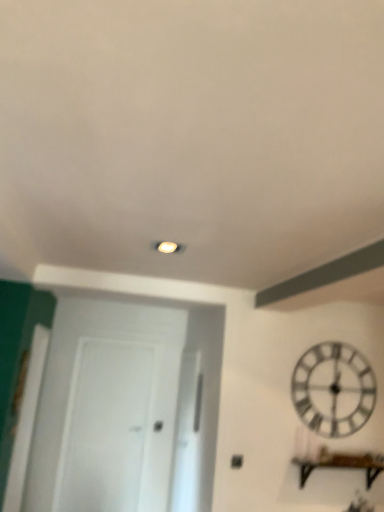
Question: Are transparent glass door at center, the first glass door from the left, and transparent glass door at center, which is the 1th glass door in right-to-left order, making contact?

Choices:
 (A) no
 (B) yes

Answer: (A)

Question: Is the depth of transparent glass door at center, the first glass door from the left, greater than that of transparent glass door at center, which is the 1th glass door in right-to-left order?

Choices:
 (A) no
 (B) yes

Answer: (B)

Question: Is transparent glass door at center, the first glass door from the left, to the left of transparent glass door at center, which is the 1th glass door in right-to-left order, from the viewer's perspective?

Choices:
 (A) no
 (B) yes

Answer: (B)

Question: Is transparent glass door at center, the first glass door from the left, positioned with its back to transparent glass door at center, which is the 1th glass door in right-to-left order?

Choices:
 (A) yes
 (B) no

Answer: (B)

Question: Is transparent glass door at center, the first glass door from the left, taller than transparent glass door at center, which is the 1th glass door in right-to-left order?

Choices:
 (A) no
 (B) yes

Answer: (B)

Question: From a real-world perspective, is transparent glass door at center, the first glass door from the left, above or below white wooden clock at upper right?

Choices:
 (A) below
 (B) above

Answer: (A)

Question: Is transparent glass door at center, the first glass door from the left, in front of or behind white wooden clock at upper right in the image?

Choices:
 (A) front
 (B) behind

Answer: (B)

Question: From the image's perspective, is transparent glass door at center, the first glass door from the left, above or below white wooden clock at upper right?

Choices:
 (A) below
 (B) above

Answer: (A)

Question: Would you say transparent glass door at center, the first glass door from the left, is to the left or to the right of white wooden clock at upper right in the picture?

Choices:
 (A) left
 (B) right

Answer: (A)

Question: Is brown wooden shelf at lower right bigger or smaller than transparent glass door at center, the 2th glass door positioned from the left?

Choices:
 (A) big
 (B) small

Answer: (B)

Question: Relative to transparent glass door at center, the 2th glass door positioned from the left, is brown wooden shelf at lower right in front or behind?

Choices:
 (A) behind
 (B) front

Answer: (B)

Question: Choose the correct answer: Is brown wooden shelf at lower right inside transparent glass door at center, the 2th glass door positioned from the left, or outside it?

Choices:
 (A) outside
 (B) inside

Answer: (A)

Question: Is point (355, 457) positioned closer to the camera than point (190, 411)?

Choices:
 (A) farther
 (B) closer

Answer: (B)

Question: From the image's perspective, is brown wooden shelf at lower right positioned above or below white wooden clock at upper right?

Choices:
 (A) above
 (B) below

Answer: (B)

Question: From a real-world perspective, is brown wooden shelf at lower right above or below white wooden clock at upper right?

Choices:
 (A) below
 (B) above

Answer: (A)